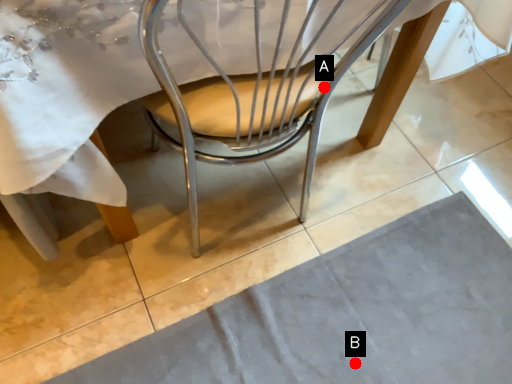
Question: Two points are circled on the image, labeled by A and B beside each circle. Which point is farther from the camera taking this photo?

Choices:
 (A) A is further
 (B) B is further

Answer: (B)